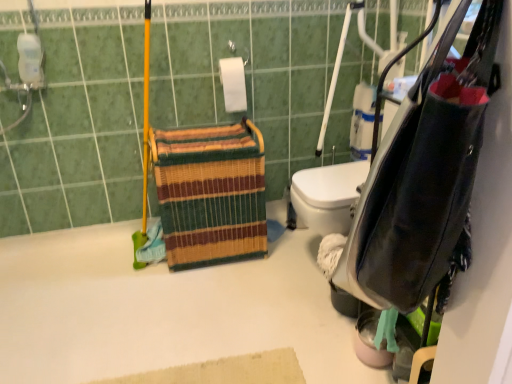
Question: Is white matte bath at upper left bigger than multicolored woven basket at center?

Choices:
 (A) no
 (B) yes

Answer: (A)

Question: Considering the relative sizes of white matte bath at upper left and multicolored woven basket at center in the image provided, is white matte bath at upper left shorter than multicolored woven basket at center?

Choices:
 (A) yes
 (B) no

Answer: (A)

Question: From a real-world perspective, does white matte bath at upper left stand above multicolored woven basket at center?

Choices:
 (A) no
 (B) yes

Answer: (A)

Question: Does white matte bath at upper left appear on the right side of multicolored woven basket at center?

Choices:
 (A) no
 (B) yes

Answer: (A)

Question: Does white matte bath at upper left turn towards multicolored woven basket at center?

Choices:
 (A) no
 (B) yes

Answer: (A)

Question: In terms of width, does white matte bath at upper left look wider or thinner when compared to multicolored woven basket at center?

Choices:
 (A) wide
 (B) thin

Answer: (A)

Question: Considering the positions of point (145, 286) and point (170, 137), is point (145, 286) closer or farther from the camera than point (170, 137)?

Choices:
 (A) farther
 (B) closer

Answer: (A)

Question: Is white matte bath at upper left bigger or smaller than multicolored woven basket at center?

Choices:
 (A) big
 (B) small

Answer: (B)

Question: From the image's perspective, relative to multicolored woven basket at center, is white matte bath at upper left above or below?

Choices:
 (A) above
 (B) below

Answer: (B)

Question: Is multicolored woven basket at center bigger or smaller than white matte bath at upper left?

Choices:
 (A) big
 (B) small

Answer: (A)

Question: From the image's perspective, is multicolored woven basket at center located above or below white matte bath at upper left?

Choices:
 (A) above
 (B) below

Answer: (A)

Question: Is point (252, 253) closer or farther from the camera than point (192, 271)?

Choices:
 (A) closer
 (B) farther

Answer: (B)

Question: In terms of width, does multicolored woven basket at center look wider or thinner when compared to white matte bath at upper left?

Choices:
 (A) thin
 (B) wide

Answer: (A)

Question: From their relative heights in the image, would you say leather-like black bag at right is taller or shorter than multicolored woven basket at center?

Choices:
 (A) tall
 (B) short

Answer: (B)

Question: Looking at the image, does leather-like black bag at right seem bigger or smaller compared to multicolored woven basket at center?

Choices:
 (A) small
 (B) big

Answer: (A)